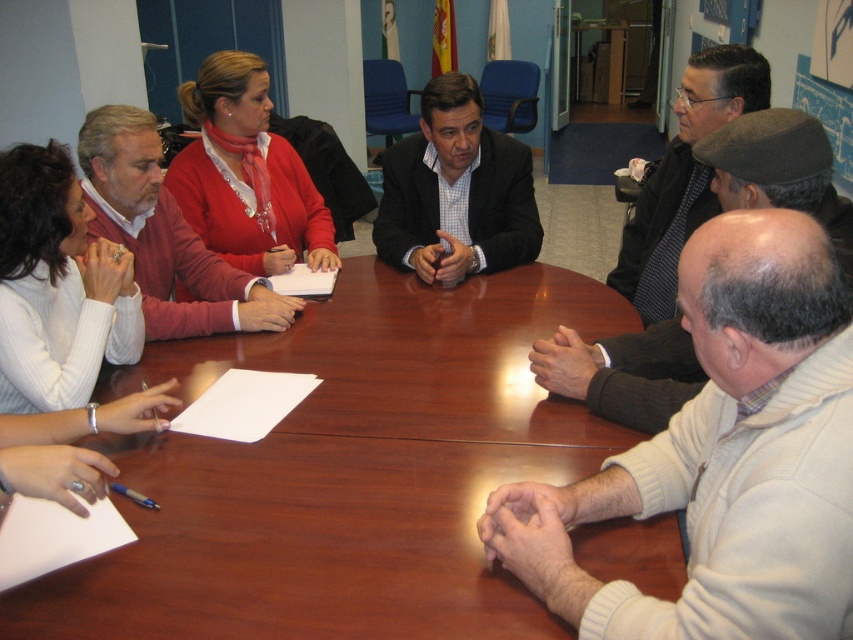
Question: Can you confirm if brown polished wood round table at center is smaller than dark gray textured jacket at upper right?

Choices:
 (A) yes
 (B) no

Answer: (B)

Question: Which point is closer to the camera taking this photo?

Choices:
 (A) (824, 252)
 (B) (334, 237)
 (C) (648, 372)
 (D) (660, 294)

Answer: (A)

Question: Can you confirm if white knit sweater at center is positioned to the left of white matte sweater at upper left?

Choices:
 (A) no
 (B) yes

Answer: (A)

Question: Which point is farther to the camera?

Choices:
 (A) (680, 212)
 (B) (383, 241)

Answer: (B)

Question: Does dark gray suit at center lie behind matte red sweater at upper left?

Choices:
 (A) yes
 (B) no

Answer: (A)

Question: Which point appears closest to the camera in this image?

Choices:
 (A) (248, 220)
 (B) (680, 124)
 (C) (442, 92)
 (D) (712, 310)

Answer: (D)